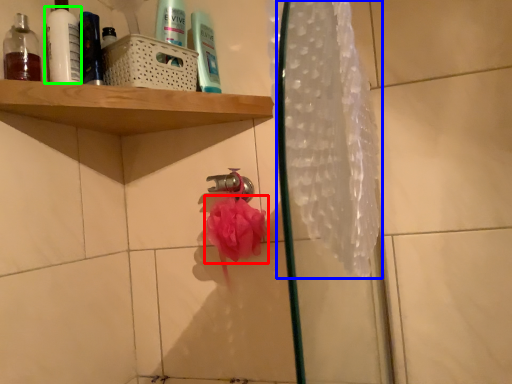
Question: Considering the real-world distances, which object is closest to flower (highlighted by a red box)? shower curtain (highlighted by a blue box) or mouthwash (highlighted by a green box).

Choices:
 (A) shower curtain
 (B) mouthwash

Answer: (A)